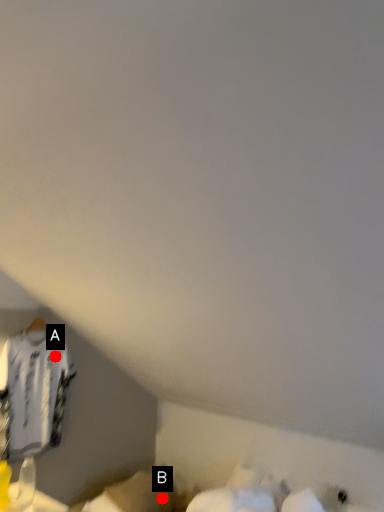
Question: Two points are circled on the image, labeled by A and B beside each circle. Which point is farther to the camera?

Choices:
 (A) A is further
 (B) B is further

Answer: (A)